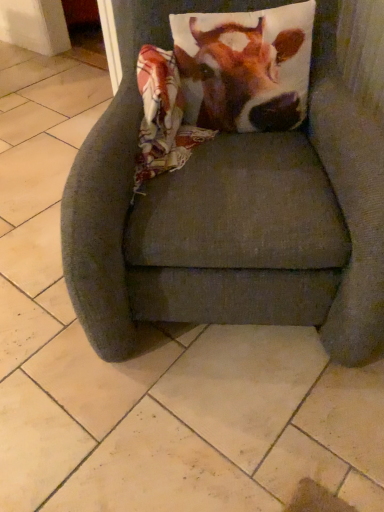
Question: Should I look upward or downward to see cow print pillow at upper center?

Choices:
 (A) down
 (B) up

Answer: (B)

Question: From the image's perspective, is cow print pillow at upper center below dark gray fabric chair at center?

Choices:
 (A) yes
 (B) no

Answer: (B)

Question: Is cow print pillow at upper center at the right side of dark gray fabric chair at center?

Choices:
 (A) yes
 (B) no

Answer: (A)

Question: Is cow print pillow at upper center to the left of dark gray fabric chair at center from the viewer's perspective?

Choices:
 (A) no
 (B) yes

Answer: (A)

Question: Is cow print pillow at upper center directly adjacent to dark gray fabric chair at center?

Choices:
 (A) yes
 (B) no

Answer: (B)

Question: Does cow print pillow at upper center have a lesser height compared to dark gray fabric chair at center?

Choices:
 (A) no
 (B) yes

Answer: (B)

Question: Can you confirm if cow print pillow at upper center is wider than dark gray fabric chair at center?

Choices:
 (A) yes
 (B) no

Answer: (B)

Question: Does dark gray fabric chair at center have a greater height compared to cow print pillow at upper center?

Choices:
 (A) no
 (B) yes

Answer: (B)

Question: From a real-world perspective, does dark gray fabric chair at center sit lower than cow print pillow at upper center?

Choices:
 (A) yes
 (B) no

Answer: (A)

Question: Is dark gray fabric chair at center at the left side of cow print pillow at upper center?

Choices:
 (A) no
 (B) yes

Answer: (B)

Question: Is dark gray fabric chair at center completely or partially outside of cow print pillow at upper center?

Choices:
 (A) yes
 (B) no

Answer: (A)

Question: Would you say dark gray fabric chair at center is a long distance from cow print pillow at upper center?

Choices:
 (A) yes
 (B) no

Answer: (B)

Question: Does dark gray fabric chair at center have a lesser width compared to cow print pillow at upper center?

Choices:
 (A) yes
 (B) no

Answer: (B)

Question: From their relative heights in the image, would you say cow print pillow at upper center is taller or shorter than dark gray fabric chair at center?

Choices:
 (A) short
 (B) tall

Answer: (A)